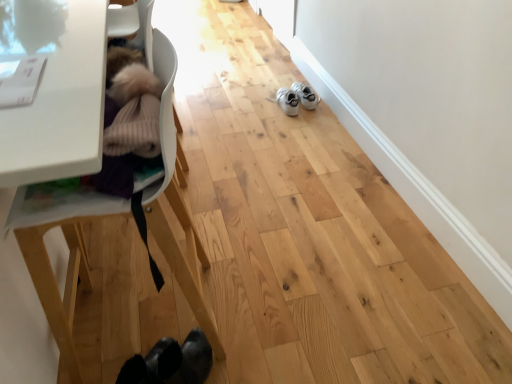
What do you see at coordinates (71, 254) in the screenshot? The image size is (512, 384). I see `white plastic baby carriage at left` at bounding box center [71, 254].

In order to face white plastic baby carriage at left, should I rotate leftwards or rightwards?

Turn left by 17.859 degrees to look at white plastic baby carriage at left.

Locate an element on the screen. This screenshot has width=512, height=384. white plastic baby carriage at left is located at coordinates (71, 254).

Image resolution: width=512 pixels, height=384 pixels. I want to click on white suede shoes at center, so click(306, 95).

This screenshot has width=512, height=384. What do you see at coordinates (306, 95) in the screenshot?
I see `white suede shoes at center` at bounding box center [306, 95].

Locate an element on the screen. white plastic baby carriage at left is located at coordinates (71, 254).

Is white suede shoes at center to the left of white plastic baby carriage at left from the viewer's perspective?

Incorrect, white suede shoes at center is not on the left side of white plastic baby carriage at left.

Relative to white plastic baby carriage at left, is white suede shoes at center in front or behind?

In the image, white suede shoes at center appears behind white plastic baby carriage at left.

Considering the points (297, 91) and (155, 232), which point is behind, point (297, 91) or point (155, 232)?

The point (297, 91) is behind.

From the image's perspective, is white suede shoes at center positioned above or below white plastic baby carriage at left?

white suede shoes at center is situated higher than white plastic baby carriage at left in the image.

From a real-world perspective, who is located lower, white suede shoes at center or white plastic baby carriage at left?

white suede shoes at center is physically lower.

Considering the sizes of objects white suede shoes at center and white plastic baby carriage at left in the image provided, who is thinner, white suede shoes at center or white plastic baby carriage at left?

Thinner between the two is white suede shoes at center.

Who is taller, white suede shoes at center or white plastic baby carriage at left?

white plastic baby carriage at left is taller.

Based on the photo, is white suede shoes at center bigger than white plastic baby carriage at left?

Incorrect, white suede shoes at center is not larger than white plastic baby carriage at left.

Is white suede shoes at center outside of white plastic baby carriage at left?

Yes, white suede shoes at center is not within white plastic baby carriage at left.

Is white suede shoes at center far from white plastic baby carriage at left?

Indeed, white suede shoes at center is not near white plastic baby carriage at left.

Is white suede shoes at center oriented towards white plastic baby carriage at left?

No, white suede shoes at center is not aimed at white plastic baby carriage at left.

Looking at this image, how different are the orientations of white suede shoes at center and white plastic baby carriage at left in degrees?

The angular difference between white suede shoes at center and white plastic baby carriage at left is 90.3 degrees.

This screenshot has width=512, height=384. I want to click on baby carriage that appears below the white suede shoes at center (from the image's perspective), so click(x=71, y=254).

Would you say white plastic baby carriage at left is to the left or to the right of white suede shoes at center in the picture?

In the image, white plastic baby carriage at left appears on the left side of white suede shoes at center.

Which object is further away from the camera, white plastic baby carriage at left or white suede shoes at center?

white suede shoes at center.

Does point (161, 55) come farther from viewer compared to point (298, 82)?

No, it is not.

From the image's perspective, is white plastic baby carriage at left located above or below white suede shoes at center?

From the image's perspective, white plastic baby carriage at left appears below white suede shoes at center.

From a real-world perspective, between white plastic baby carriage at left and white suede shoes at center, who is vertically higher?

From a 3D spatial view, white plastic baby carriage at left is above.

Between white plastic baby carriage at left and white suede shoes at center, which one has larger width?

white plastic baby carriage at left.

Does white plastic baby carriage at left have a lesser height compared to white suede shoes at center?

No, white plastic baby carriage at left is not shorter than white suede shoes at center.

Is white plastic baby carriage at left bigger or smaller than white suede shoes at center?

Clearly, white plastic baby carriage at left is larger in size than white suede shoes at center.

Can white suede shoes at center be found inside white plastic baby carriage at left?

That's incorrect, white suede shoes at center is not inside white plastic baby carriage at left.

Is there a large distance between white plastic baby carriage at left and white suede shoes at center?

Yes, white plastic baby carriage at left and white suede shoes at center are quite far apart.

Is white plastic baby carriage at left oriented towards white suede shoes at center?

No, white plastic baby carriage at left is not aimed at white suede shoes at center.

This screenshot has width=512, height=384. In order to click on baby carriage below the white suede shoes at center (from the image's perspective) in this screenshot , I will do `click(71, 254)`.

The image size is (512, 384). Find the location of `footwear behind the white plastic baby carriage at left`. footwear behind the white plastic baby carriage at left is located at coordinates (306, 95).

Locate an element on the screen. This screenshot has height=384, width=512. footwear located on the right of white plastic baby carriage at left is located at coordinates (306, 95).